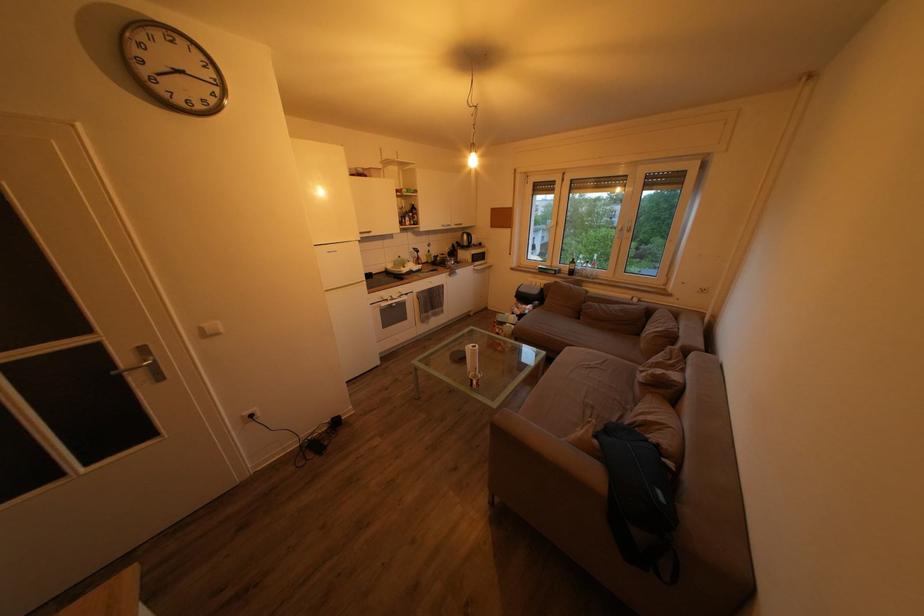
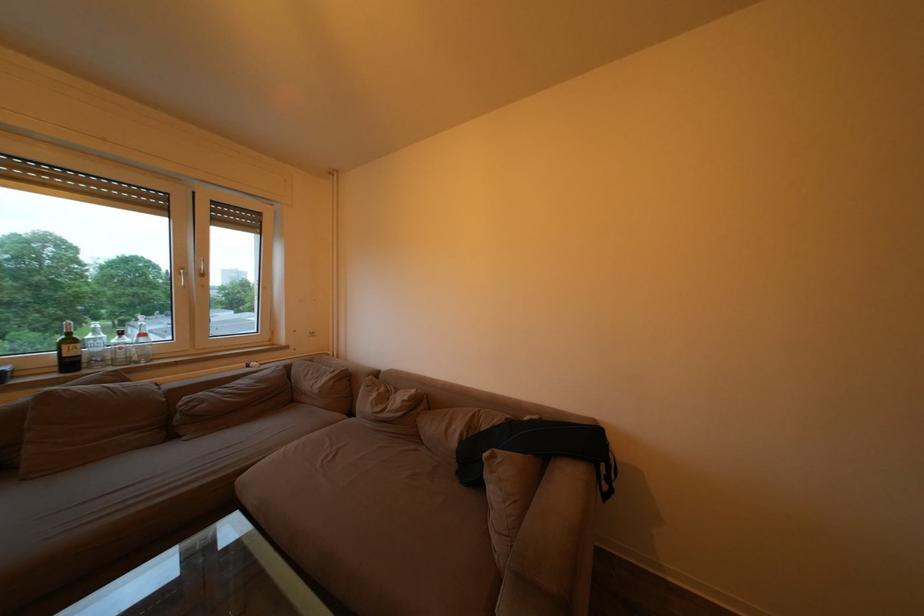
Locate, in the second image, the point that corresponds to point 678,368 in the first image.

(390, 395)